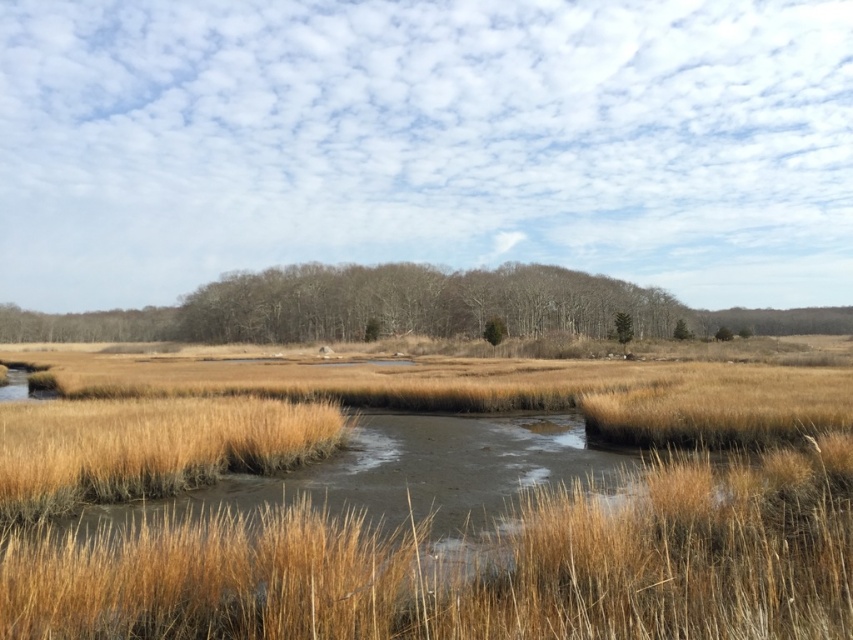
Question: Can you confirm if brown textured trees at center is smaller than green matte tree at center-right?

Choices:
 (A) yes
 (B) no

Answer: (B)

Question: Can you confirm if green matte tree at center-right is positioned below green matte tree at center?

Choices:
 (A) no
 (B) yes

Answer: (A)

Question: Estimate the real-world distances between objects in this image. Which object is closer to the green matte tree at center?

Choices:
 (A) green matte tree at center-right
 (B) brown textured trees at center

Answer: (A)

Question: Considering the real-world distances, which object is farthest from the brown textured trees at center?

Choices:
 (A) green matte tree at center-right
 (B) green matte tree at center

Answer: (B)

Question: From the image, what is the correct spatial relationship of brown textured trees at center in relation to green matte tree at center-right?

Choices:
 (A) right
 (B) left

Answer: (B)

Question: Which object is positioned farthest from the brown textured trees at center?

Choices:
 (A) green matte tree at center
 (B) green matte tree at center-right

Answer: (A)